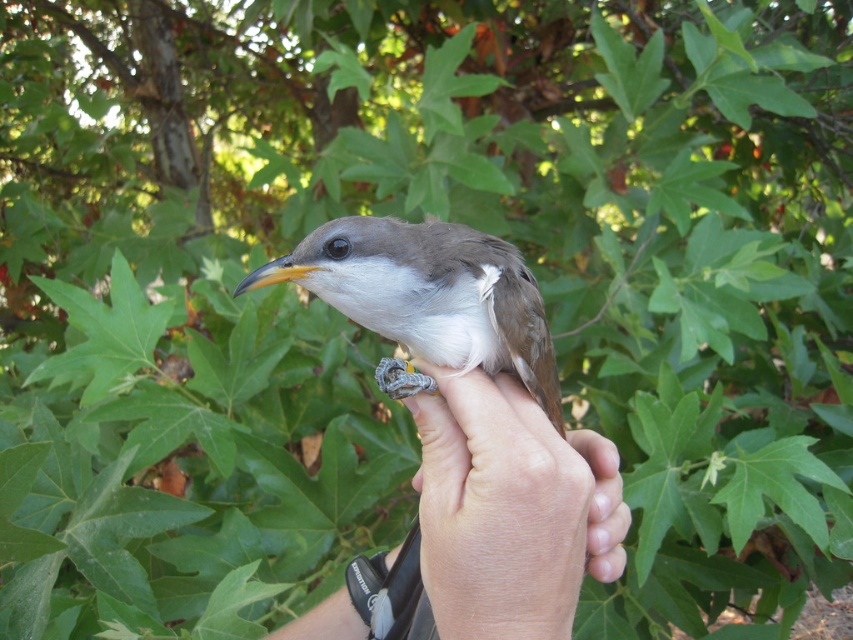
Question: Which point is closer to the camera?

Choices:
 (A) (422, 532)
 (B) (412, 278)

Answer: (A)

Question: Which object appears farthest from the camera in this image?

Choices:
 (A) brown matte bird at center
 (B) smooth skin hand at center

Answer: (A)

Question: Can you confirm if smooth skin hand at center is smaller than brown matte bird at center?

Choices:
 (A) yes
 (B) no

Answer: (B)

Question: Is smooth skin hand at center wider than brown matte bird at center?

Choices:
 (A) no
 (B) yes

Answer: (A)

Question: Which object appears closest to the camera in this image?

Choices:
 (A) smooth skin hand at center
 (B) brown matte bird at center

Answer: (A)

Question: Can you confirm if smooth skin hand at center is positioned above brown matte bird at center?

Choices:
 (A) no
 (B) yes

Answer: (A)